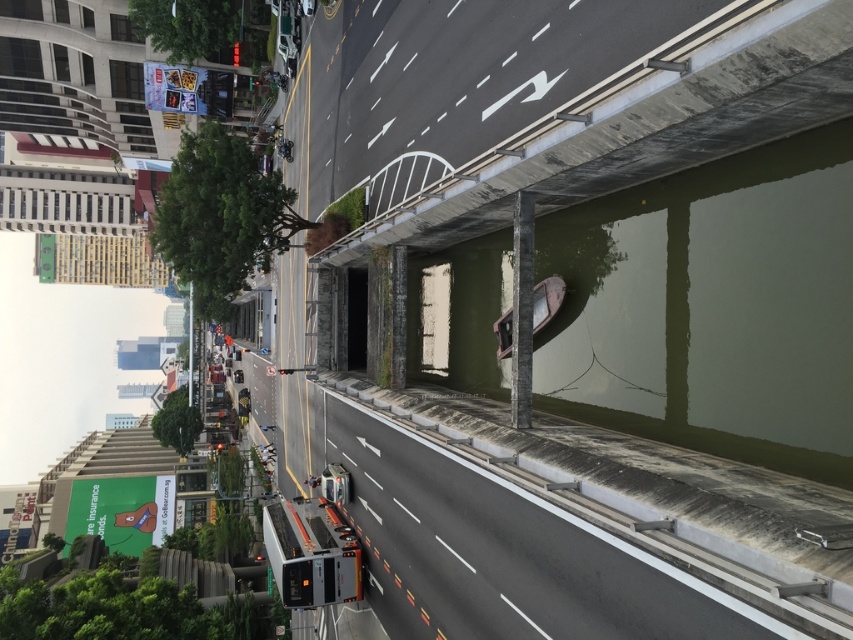
Question: Is concrete at upper center thinner than gray asphalt highway at center?

Choices:
 (A) no
 (B) yes

Answer: (B)

Question: Is concrete at upper center smaller than gray asphalt highway at center?

Choices:
 (A) no
 (B) yes

Answer: (B)

Question: Is concrete at upper center to the left of gray asphalt highway at center from the viewer's perspective?

Choices:
 (A) yes
 (B) no

Answer: (B)